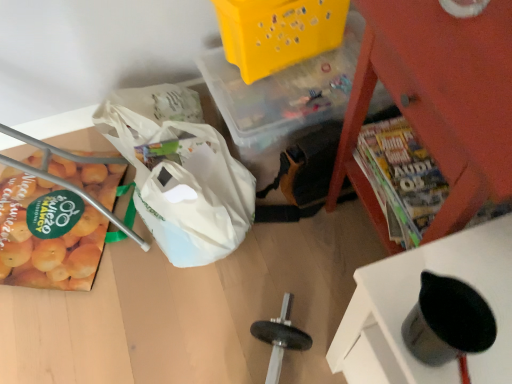
Question: Would you say silver metallic cup at lower right, arranged as the 1th furniture when viewed from the front, is outside yellow plastic basket at upper center?

Choices:
 (A) yes
 (B) no

Answer: (A)

Question: Is silver metallic cup at lower right, the second furniture viewed from the back, to the right of yellow plastic basket at upper center from the viewer's perspective?

Choices:
 (A) no
 (B) yes

Answer: (B)

Question: From a real-world perspective, is silver metallic cup at lower right, arranged as the 1th furniture when viewed from the front, physically above yellow plastic basket at upper center?

Choices:
 (A) yes
 (B) no

Answer: (A)

Question: Considering the relative sizes of silver metallic cup at lower right, the second furniture viewed from the back, and yellow plastic basket at upper center in the image provided, is silver metallic cup at lower right, the second furniture viewed from the back, smaller than yellow plastic basket at upper center?

Choices:
 (A) yes
 (B) no

Answer: (A)

Question: Is silver metallic cup at lower right, arranged as the 1th furniture when viewed from the front, wider than yellow plastic basket at upper center?

Choices:
 (A) no
 (B) yes

Answer: (A)

Question: Can you confirm if silver metallic cup at lower right, arranged as the 1th furniture when viewed from the front, is taller than yellow plastic basket at upper center?

Choices:
 (A) yes
 (B) no

Answer: (B)

Question: Is white plastic grocery bag at lower left closer to camera compared to silver metallic cup at lower right, arranged as the 1th furniture when viewed from the front?

Choices:
 (A) yes
 (B) no

Answer: (B)

Question: Is white plastic grocery bag at lower left looking in the opposite direction of silver metallic cup at lower right, arranged as the 1th furniture when viewed from the front?

Choices:
 (A) no
 (B) yes

Answer: (A)

Question: Does white plastic grocery bag at lower left have a greater width compared to silver metallic cup at lower right, arranged as the 1th furniture when viewed from the front?

Choices:
 (A) yes
 (B) no

Answer: (A)

Question: Could silver metallic cup at lower right, arranged as the 1th furniture when viewed from the front, be considered to be inside white plastic grocery bag at lower left?

Choices:
 (A) no
 (B) yes

Answer: (A)

Question: Considering the relative sizes of white plastic grocery bag at lower left and silver metallic cup at lower right, the second furniture viewed from the back, in the image provided, is white plastic grocery bag at lower left bigger than silver metallic cup at lower right, the second furniture viewed from the back,?

Choices:
 (A) yes
 (B) no

Answer: (A)

Question: From a real-world perspective, is white plastic grocery bag at lower left over silver metallic cup at lower right, arranged as the 1th furniture when viewed from the front?

Choices:
 (A) no
 (B) yes

Answer: (A)

Question: Is yellow matte oranges at left closer to camera compared to metallic red magazine rack at upper right, the second furniture positioned from the front?

Choices:
 (A) no
 (B) yes

Answer: (A)